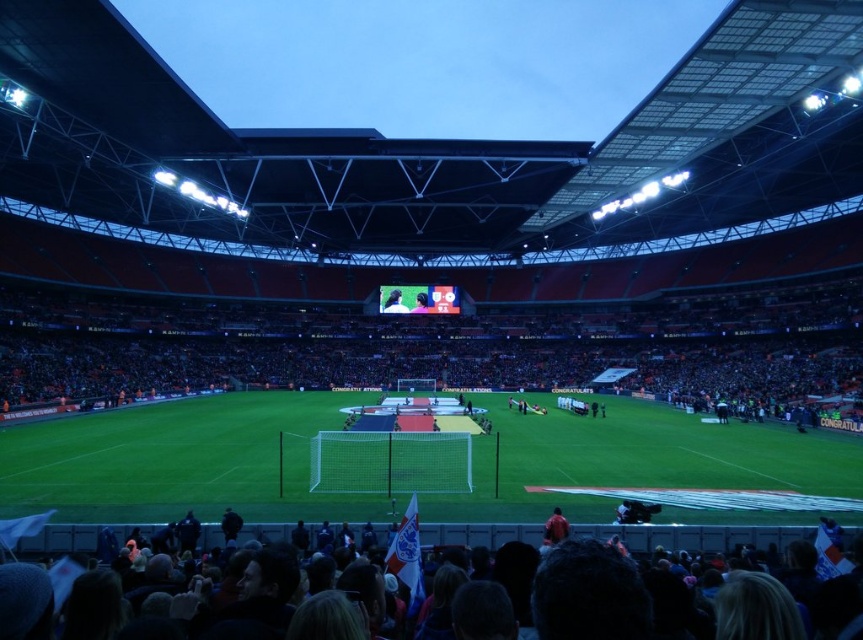
Does green grass football field at center have a lesser height compared to smooth black shirt at center?

Yes.

Based on the photo, does green grass football field at center appear under smooth black shirt at center?

Yes, green grass football field at center is below smooth black shirt at center.

Locate an element on the screen. green grass football field at center is located at coordinates click(x=177, y=460).

Identify the location of green grass football field at center. (177, 460).

Can you confirm if dark orange stadium seats at center is thinner than dark hair at lower center?

Incorrect, dark orange stadium seats at center's width is not less than dark hair at lower center's.

Is dark orange stadium seats at center closer to the viewer compared to dark hair at lower center?

No, dark orange stadium seats at center is further to the viewer.

The image size is (863, 640). Find the location of `dark orange stadium seats at center`. dark orange stadium seats at center is located at coordinates (426, 344).

Locate an element on the screen. This screenshot has width=863, height=640. dark orange stadium seats at center is located at coordinates (426, 344).

Between point (545, 536) and point (394, 296), which one is positioned behind?

The point (394, 296) is more distant.

Is green fabric jacket at lower right bigger than smooth skin face at center?

Incorrect, green fabric jacket at lower right is not larger than smooth skin face at center.

What do you see at coordinates (555, 529) in the screenshot? I see `green fabric jacket at lower right` at bounding box center [555, 529].

The width and height of the screenshot is (863, 640). In order to click on green fabric jacket at lower right in this screenshot , I will do `click(555, 529)`.